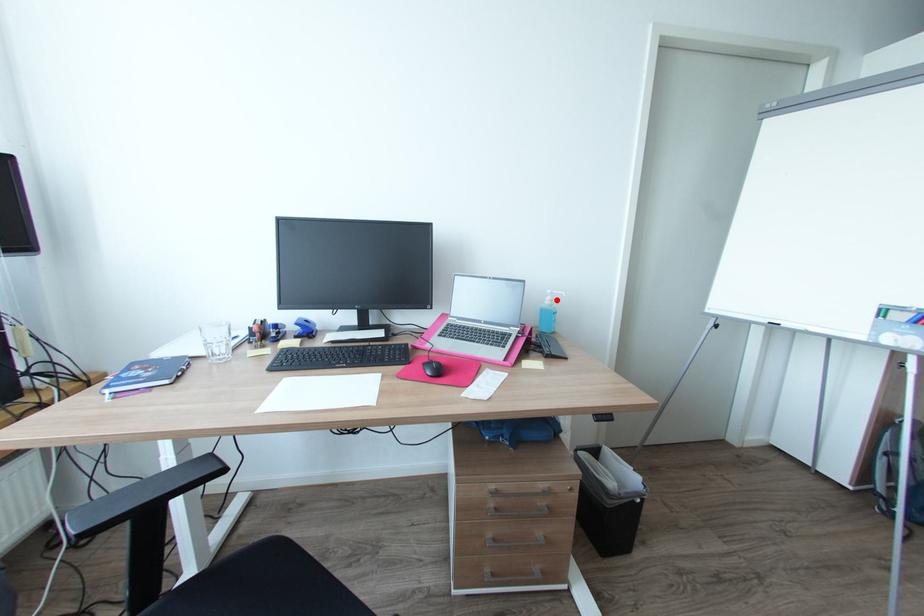
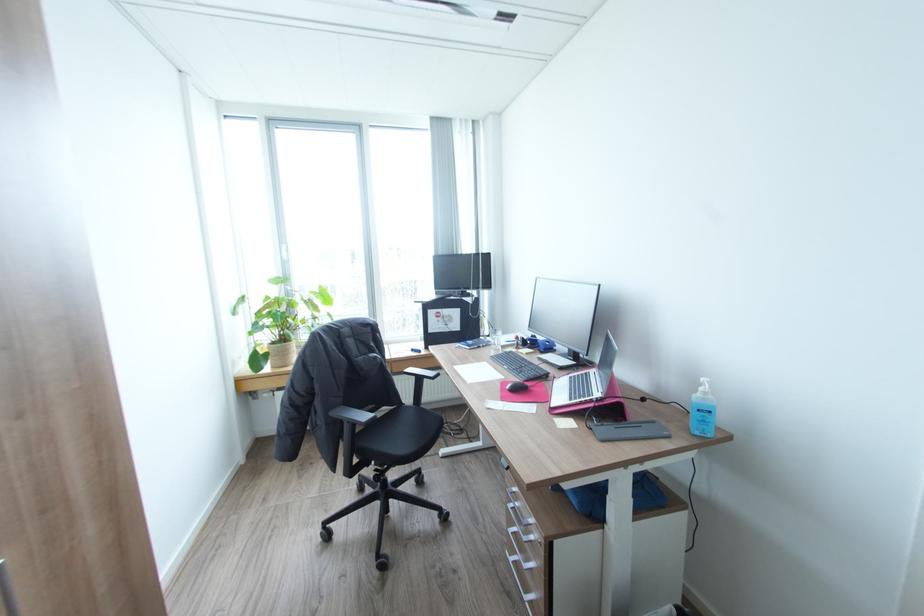
The point at the highlighted location is marked in the first image. Where is the corresponding point in the second image?

(710, 392)